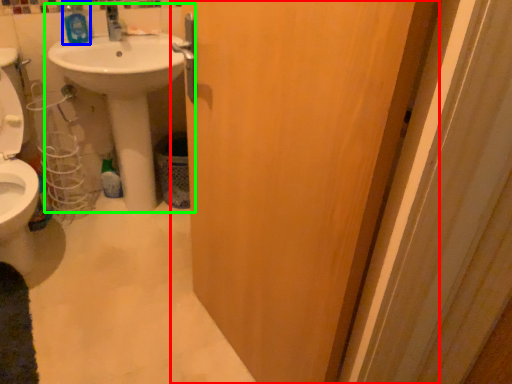
Question: Which object is positioned closest to door (highlighted by a red box)? Select from mouthwash (highlighted by a blue box) and sink (highlighted by a green box).

Choices:
 (A) mouthwash
 (B) sink

Answer: (B)